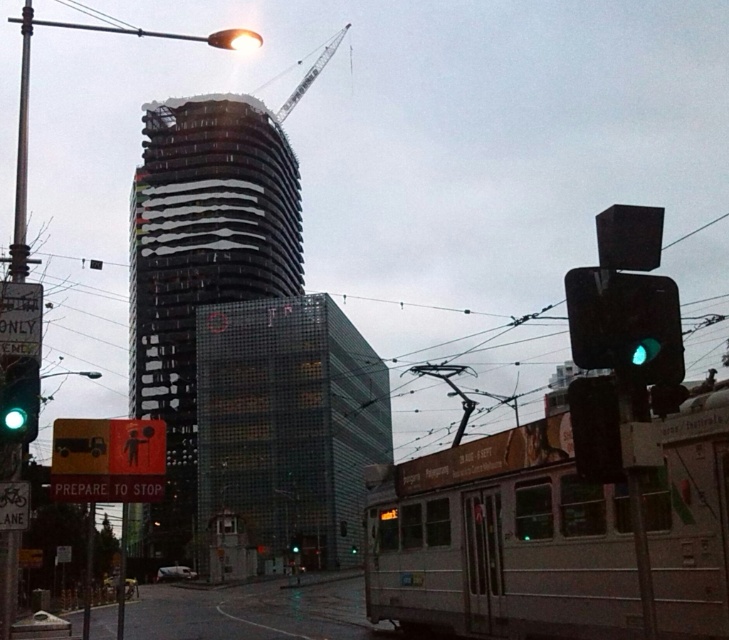
You are a city planner analyzing the layout of this urban area. Given the silver metallic train at center and the green glass traffic light at center, which object occupies a larger horizontal space in the image?

The silver metallic train at center occupies a larger horizontal space than the green glass traffic light at center because its width is larger according to the description.

You are standing at the tram and want to walk to the traffic light. Which point, point (x=521, y=506) or point (x=233, y=312), is closer to the traffic light?

Point (x=233, y=312) is closer to the traffic light because it is behind point (x=521, y=506).

You are a pedestrian trying to cross the street safely. The tram is approaching from your left. The traffic light is green. How far apart are the silver metallic train at center and the green glass traffic light at center?

The silver metallic train at center and the green glass traffic light at center are 195.93 feet apart from each other.